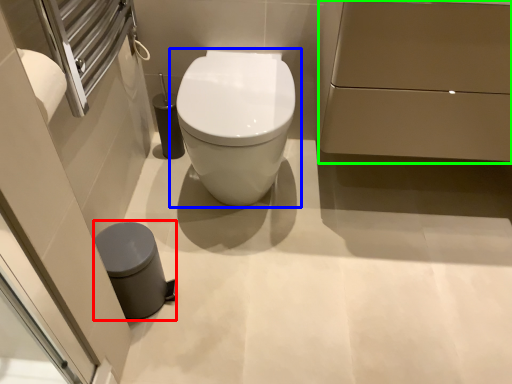
Question: Which is farther away from porcelain (highlighted by a red box)? toilet (highlighted by a blue box) or porcelain (highlighted by a green box)?

Choices:
 (A) toilet
 (B) porcelain

Answer: (B)